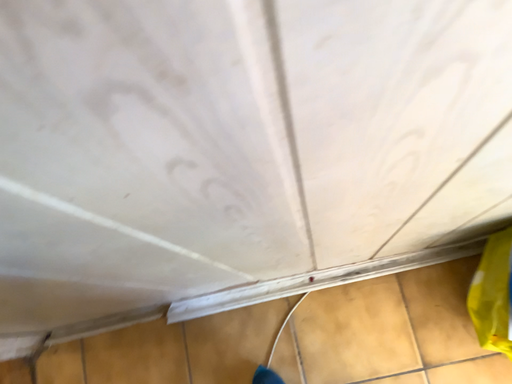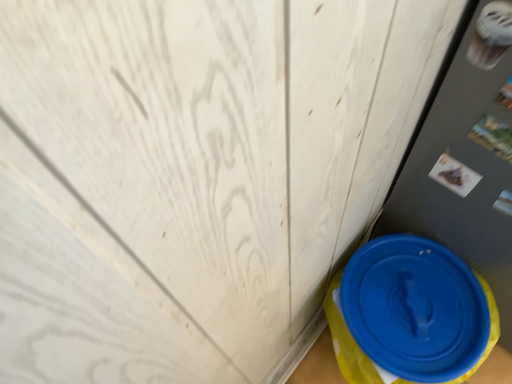
Question: Which way did the camera rotate in the video?

Choices:
 (A) rotated right
 (B) rotated left

Answer: (A)